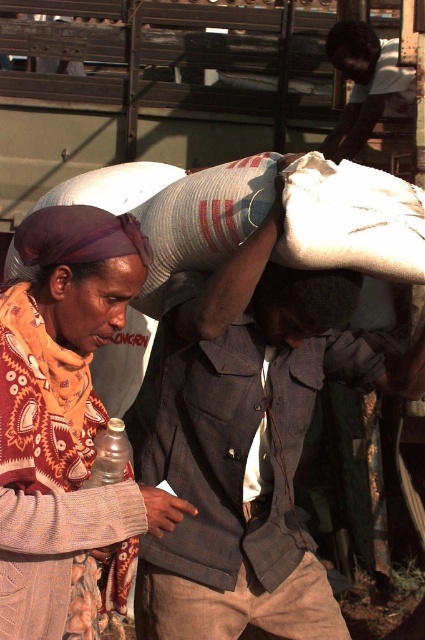
You are a photographer trying to capture both the knitted wool scarf at left and the purple fabric headscarf at center in a single frame. Which of the two items should you adjust your camera focus on first if you want to ensure both are in focus, considering their sizes?

The knitted wool scarf at left is wider than the purple fabric headscarf at center, so you should focus on the knitted wool scarf at left first to ensure both are in focus.

Based on the scene described, where is the knitted wool scarf at left located in terms of its position relative to other objects?

The knitted wool scarf at left is positioned at the coordinates 0.644 along the x axis and 0.151 along the y axis.

You are a photographer trying to capture the scene of the two workers. You notice the knitted wool scarf at left and the purple fabric headscarf at center. Which of these two items would appear larger in your photo if you frame the shot to include both?

The knitted wool scarf at left would appear larger in the photo because it is taller than the purple fabric headscarf at center.